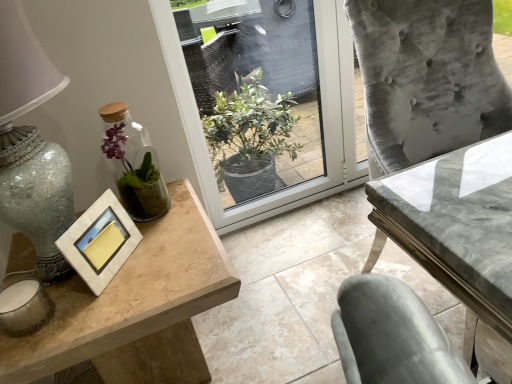
Question: In the image, is wooden table at left, which is the 1th table in left-to-right order, on the left side or the right side of clear glass vase at left?

Choices:
 (A) right
 (B) left

Answer: (B)

Question: Considering the positions of wooden table at left, which is the 1th table in left-to-right order, and clear glass vase at left in the image, is wooden table at left, which is the 1th table in left-to-right order, taller or shorter than clear glass vase at left?

Choices:
 (A) short
 (B) tall

Answer: (B)

Question: Which of these objects is positioned farthest from the matte silver picture frame at left?

Choices:
 (A) clear glass vase at left
 (B) wooden table at left, which is the 1th table in left-to-right order
 (C) transparent glass window at center
 (D) marble gray table at center, which ranks as the first table in right-to-left order

Answer: (C)

Question: Which is nearer to the matte silver picture frame at left?

Choices:
 (A) clear glass vase at left
 (B) transparent glass window at center
 (C) marble gray table at center, which ranks as the first table in right-to-left order
 (D) wooden table at left, marked as the second table in a right-to-left arrangement

Answer: (D)